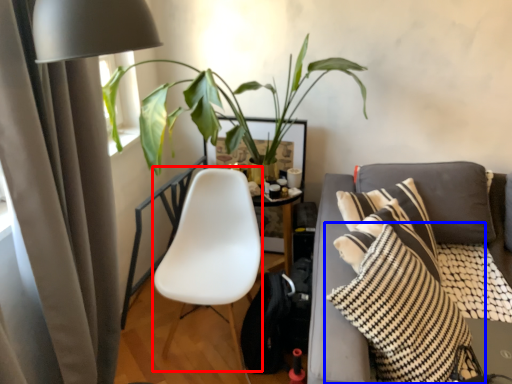
Question: Which object appears closest to the camera in this image, rocking chair (highlighted by a red box) or pillow (highlighted by a blue box)?

Choices:
 (A) rocking chair
 (B) pillow

Answer: (B)